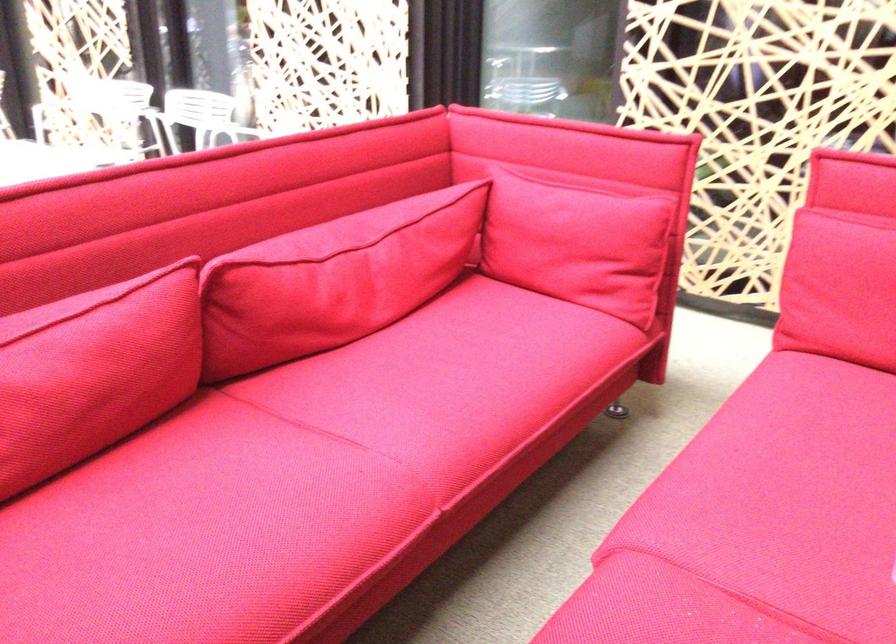
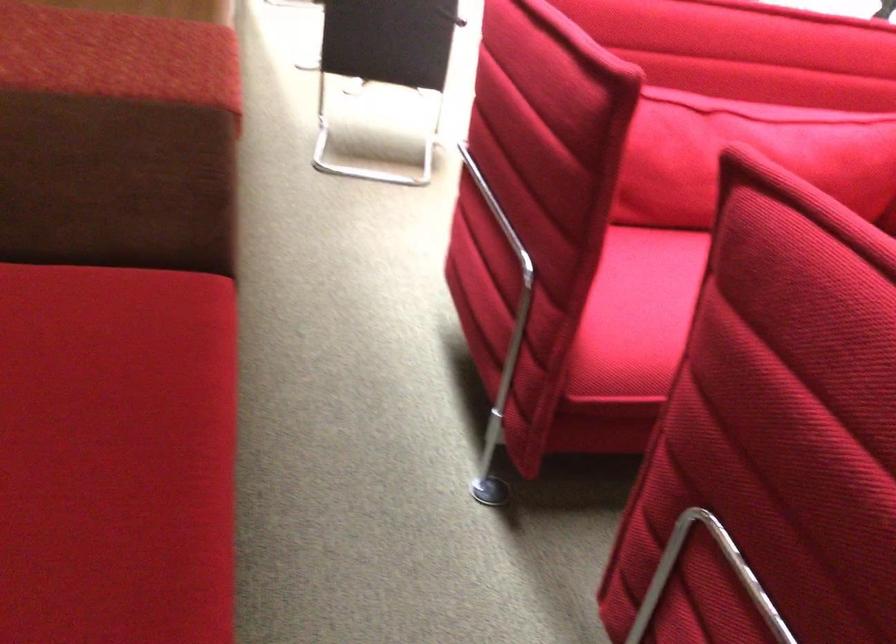
Question: The camera is either moving clockwise (left) or counter-clockwise (right) around the object. The first image is from the beginning of the video and the second image is from the end. Is the camera moving left or right when shooting the video?

Choices:
 (A) Left
 (B) Right

Answer: (B)